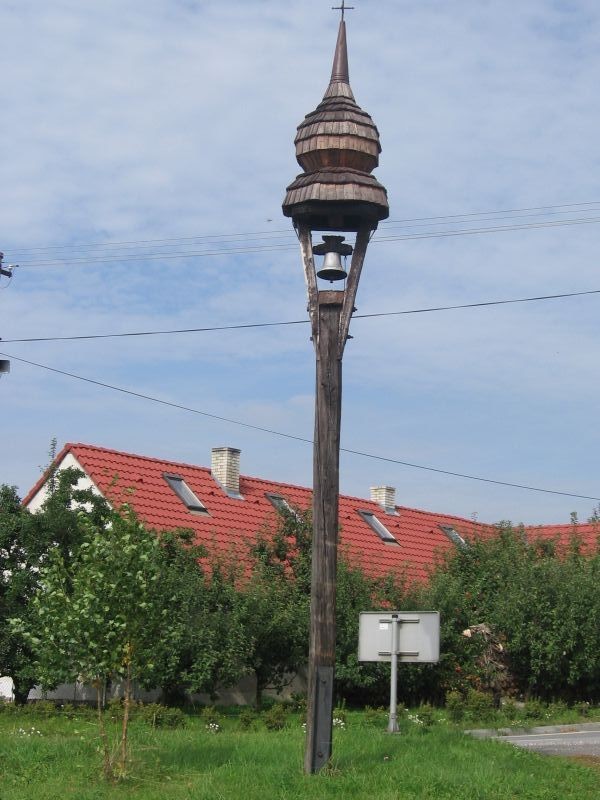
Image resolution: width=600 pixels, height=800 pixels. I want to click on wood topper on post, so click(341, 120).